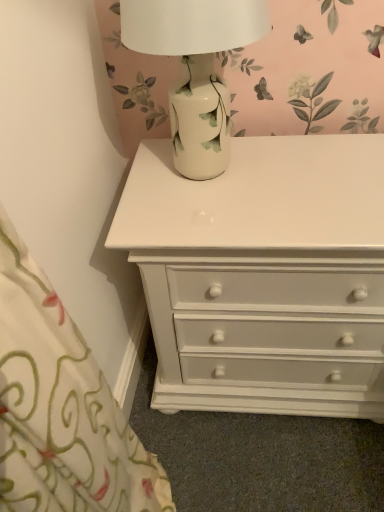
This screenshot has width=384, height=512. I want to click on porcelain vase at upper center, so click(195, 69).

The height and width of the screenshot is (512, 384). Describe the element at coordinates (195, 69) in the screenshot. I see `porcelain vase at upper center` at that location.

Where is `white glossy chest of drawers at center`? white glossy chest of drawers at center is located at coordinates (256, 261).

What do you see at coordinates (256, 261) in the screenshot?
I see `white glossy chest of drawers at center` at bounding box center [256, 261].

Where is `porcelain vase at upper center`? porcelain vase at upper center is located at coordinates (195, 69).

Which is more to the right, white glossy chest of drawers at center or porcelain vase at upper center?

Positioned to the right is white glossy chest of drawers at center.

Is white glossy chest of drawers at center positioned before porcelain vase at upper center?

No, the depth of white glossy chest of drawers at center is greater than that of porcelain vase at upper center.

Is point (154, 163) more distant than point (222, 98)?

Yes, point (154, 163) is farther from viewer.

From the image's perspective, is white glossy chest of drawers at center on porcelain vase at upper center?

No.

Consider the image. From a real-world perspective, is white glossy chest of drawers at center physically above porcelain vase at upper center?

No, from a real-world perspective, white glossy chest of drawers at center is not on top of porcelain vase at upper center.

Is white glossy chest of drawers at center thinner than porcelain vase at upper center?

No, white glossy chest of drawers at center is not thinner than porcelain vase at upper center.

Considering the sizes of white glossy chest of drawers at center and porcelain vase at upper center in the image, is white glossy chest of drawers at center taller or shorter than porcelain vase at upper center?

white glossy chest of drawers at center is taller than porcelain vase at upper center.

Looking at this image, between white glossy chest of drawers at center and porcelain vase at upper center, which one has smaller size?

With smaller size is porcelain vase at upper center.

Is white glossy chest of drawers at center inside the boundaries of porcelain vase at upper center, or outside?

The correct answer is: outside.

Are white glossy chest of drawers at center and porcelain vase at upper center beside each other?

No, white glossy chest of drawers at center is not in contact with porcelain vase at upper center.

Consider the image. Is white glossy chest of drawers at center oriented towards porcelain vase at upper center?

No, white glossy chest of drawers at center is not aimed at porcelain vase at upper center.

How many degrees apart are the facing directions of white glossy chest of drawers at center and porcelain vase at upper center?

They differ by 1.82 degrees in their facing directions.

Measure the distance from white glossy chest of drawers at center to porcelain vase at upper center.

white glossy chest of drawers at center and porcelain vase at upper center are 26.12 centimeters apart from each other.

In the image, there is a white glossy chest of drawers at center. What are the coordinates of `table lamp above it (from the image's perspective)` in the screenshot? It's located at (195, 69).

Is porcelain vase at upper center to the right of white glossy chest of drawers at center from the viewer's perspective?

In fact, porcelain vase at upper center is to the left of white glossy chest of drawers at center.

Is porcelain vase at upper center positioned before white glossy chest of drawers at center?

Yes, the depth of porcelain vase at upper center is less than that of white glossy chest of drawers at center.

Which is closer, (225, 98) or (185, 354)?

Point (225, 98) appears to be closer to the viewer than point (185, 354).

From the image's perspective, is porcelain vase at upper center over white glossy chest of drawers at center?

Yes, from the image's perspective, porcelain vase at upper center is on top of white glossy chest of drawers at center.

From a real-world perspective, which object rests below the other?

From a 3D spatial view, white glossy chest of drawers at center is below.

Which object is wider, porcelain vase at upper center or white glossy chest of drawers at center?

With larger width is white glossy chest of drawers at center.

Is porcelain vase at upper center shorter than white glossy chest of drawers at center?

Yes, porcelain vase at upper center is shorter than white glossy chest of drawers at center.

Which of these two, porcelain vase at upper center or white glossy chest of drawers at center, is smaller?

Smaller between the two is porcelain vase at upper center.

Is white glossy chest of drawers at center a part of porcelain vase at upper center?

Actually, white glossy chest of drawers at center is outside porcelain vase at upper center.

Would you say porcelain vase at upper center is a long distance from white glossy chest of drawers at center?

No, porcelain vase at upper center is not far from white glossy chest of drawers at center.

Is porcelain vase at upper center oriented towards white glossy chest of drawers at center?

No, porcelain vase at upper center does not turn towards white glossy chest of drawers at center.

This screenshot has width=384, height=512. What are the coordinates of `chest of drawers that appears on the right of porcelain vase at upper center` in the screenshot? It's located at (256, 261).

Locate an element on the screen. table lamp that is above the white glossy chest of drawers at center (from a real-world perspective) is located at coordinates (195, 69).

Where is `chest of drawers lying on the right of porcelain vase at upper center`? The height and width of the screenshot is (512, 384). chest of drawers lying on the right of porcelain vase at upper center is located at coordinates (256, 261).